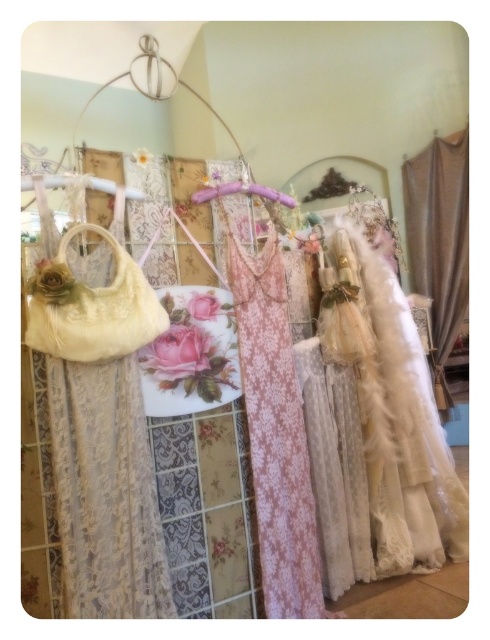
Question: Does lace fabric at left have a smaller size compared to satin beige curtain at right?

Choices:
 (A) no
 (B) yes

Answer: (B)

Question: Does lace fabric at left appear on the right side of satin beige curtain at right?

Choices:
 (A) yes
 (B) no

Answer: (B)

Question: Which of the following is the farthest from the observer?

Choices:
 (A) white lace dress at center
 (B) satin beige curtain at right
 (C) purple satin hanger at center

Answer: (B)

Question: Can you confirm if white lace dress at center is wider than satin beige curtain at right?

Choices:
 (A) no
 (B) yes

Answer: (B)

Question: Which point is closer to the camera?

Choices:
 (A) satin beige curtain at right
 (B) white lace dress at center

Answer: (B)

Question: Estimate the real-world distances between objects in this image. Which object is closer to the white lace dress at center?

Choices:
 (A) lace fabric at left
 (B) satin beige curtain at right

Answer: (A)